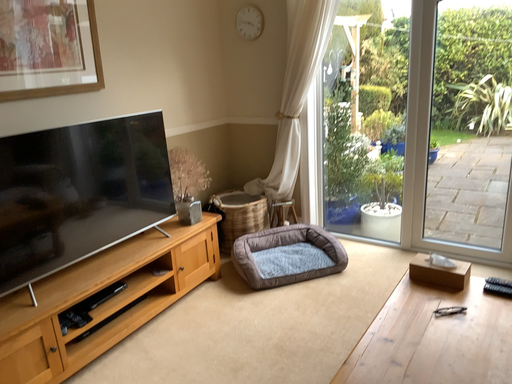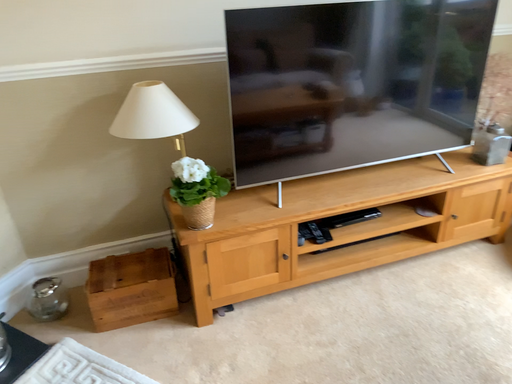
Question: Which way did the camera rotate in the video?

Choices:
 (A) rotated downward
 (B) rotated upward

Answer: (A)